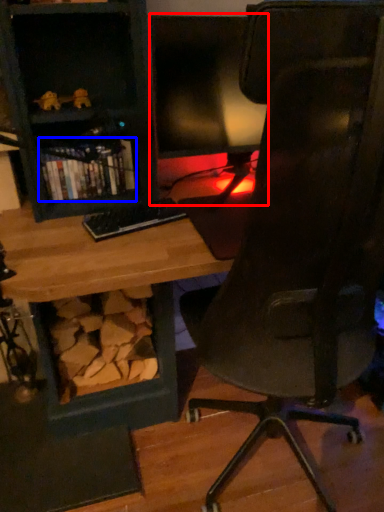
Question: Among these objects, which one is farthest to the camera, computer monitor (highlighted by a red box) or book (highlighted by a blue box)?

Choices:
 (A) computer monitor
 (B) book

Answer: (B)